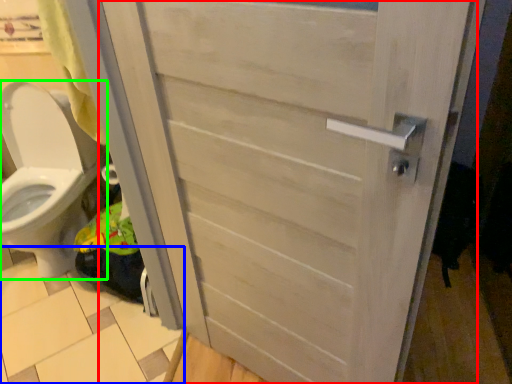
Question: Which object is positioned farthest from door (highlighted by a red box)? Select from tile (highlighted by a blue box) and toilet (highlighted by a green box).

Choices:
 (A) tile
 (B) toilet

Answer: (B)